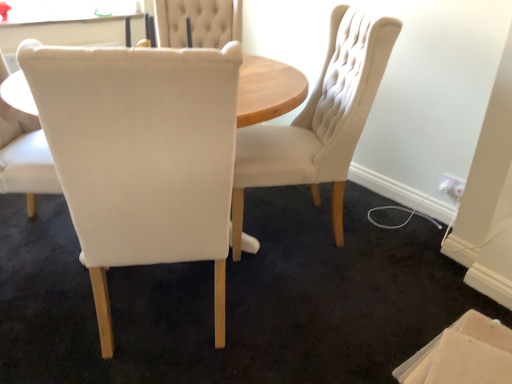
You are a GUI agent. You are given a task and a screenshot of the screen. Output one action in this format:
    pyautogui.click(x=<x>, y=<y>)
    Task: Click on the vacant area situated below matte cream chair at center, which appears as the third chair when viewed from the left (from a real-world perspective)
    This screenshot has height=384, width=512.
    Given the screenshot: What is the action you would take?
    pyautogui.click(x=285, y=226)